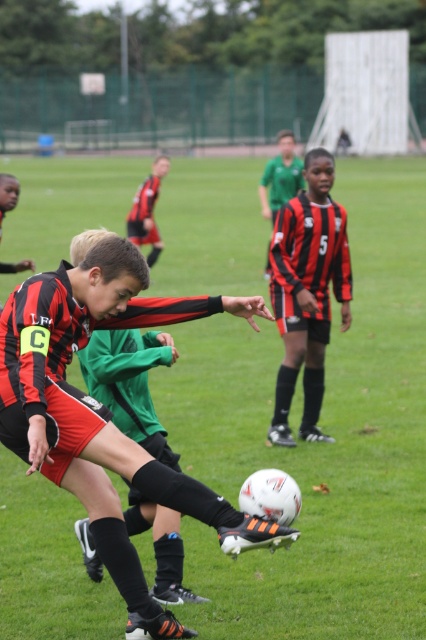
Question: Which of the following is the farthest from the observer?

Choices:
 (A) black matte jersey at center
 (B) black jersey at center

Answer: (B)

Question: Which object appears closest to the camera in this image?

Choices:
 (A) black jersey at center
 (B) black matte jersey at center

Answer: (B)

Question: Does black jersey at center have a smaller size compared to red/black jersey at center?

Choices:
 (A) no
 (B) yes

Answer: (A)

Question: Can you confirm if black matte jersey at center is positioned to the right of black jersey at center?

Choices:
 (A) yes
 (B) no

Answer: (B)

Question: Where is black jersey at center located in relation to red/black jersey at center in the image?

Choices:
 (A) above
 (B) below

Answer: (A)

Question: Which of these objects is positioned farthest from the black matte jersey at center?

Choices:
 (A) black jersey at center
 (B) red/black jersey at center

Answer: (B)